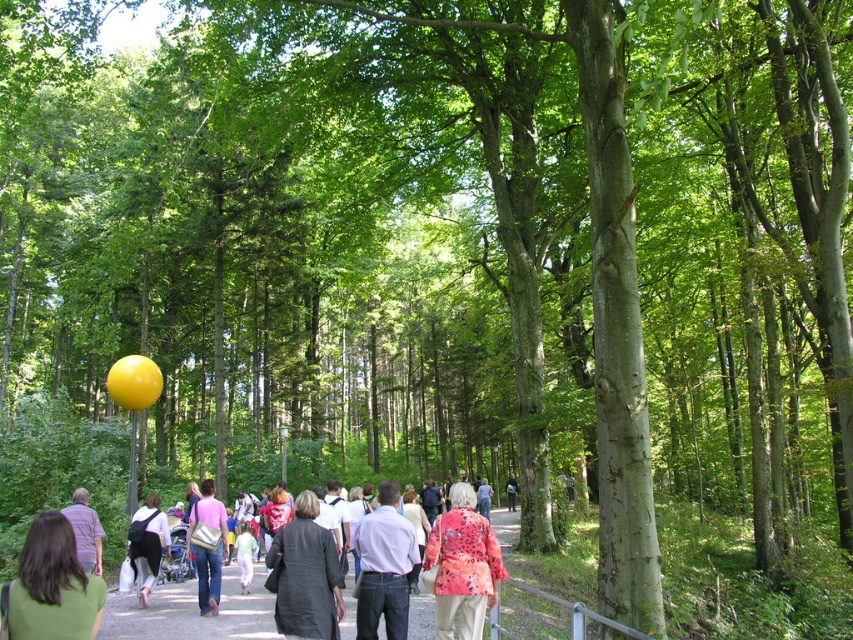
You are standing at the edge of the forest path and see the point marked at coordinates (463, 564). What object is located at that point?

The point at coordinates (463, 564) marks the location of the floral patterned fabric at center.